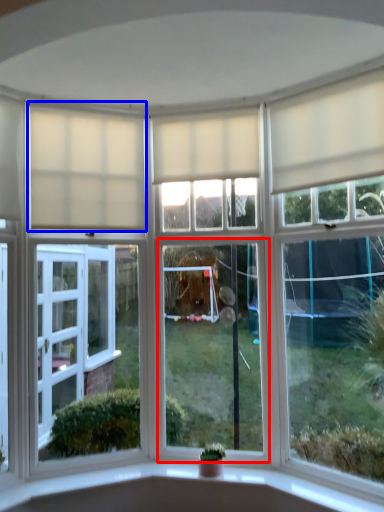
Question: Which object is further to the camera taking this photo, window (highlighted by a red box) or curtain (highlighted by a blue box)?

Choices:
 (A) window
 (B) curtain

Answer: (A)